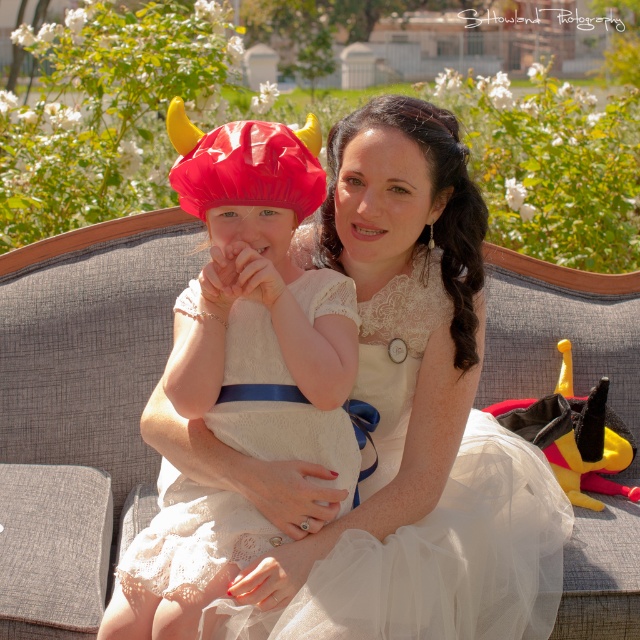
Question: Which object is closer to the camera taking this photo?

Choices:
 (A) lace fabric dress at center
 (B) matte white dress at center

Answer: (A)

Question: Is lace fabric dress at center bigger than matte white dress at center?

Choices:
 (A) yes
 (B) no

Answer: (A)

Question: Which point is closer to the camera taking this photo?

Choices:
 (A) (256, 289)
 (B) (532, 502)

Answer: (A)

Question: In this image, where is lace fabric dress at center located relative to matte white dress at center?

Choices:
 (A) above
 (B) below

Answer: (B)

Question: Can you confirm if lace fabric dress at center is thinner than matte white dress at center?

Choices:
 (A) no
 (B) yes

Answer: (A)